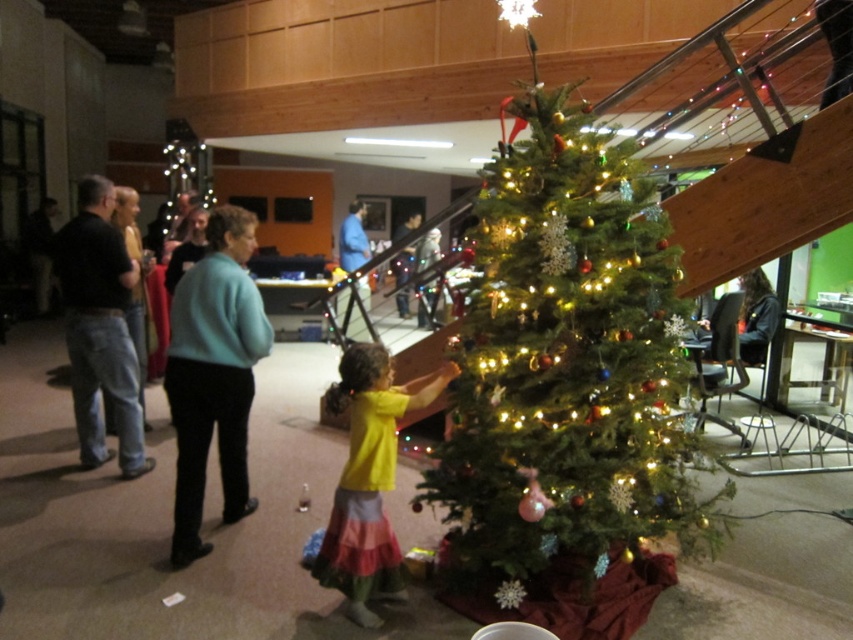
The width and height of the screenshot is (853, 640). Describe the element at coordinates (213, 374) in the screenshot. I see `teal sweater at center` at that location.

Is point (219, 268) positioned before point (68, 276)?

Yes, it is.

The height and width of the screenshot is (640, 853). Identify the location of teal sweater at center. (213, 374).

Locate an element on the screen. teal sweater at center is located at coordinates (213, 374).

Measure the distance between green matte christmas tree at center and teal sweater at center.

green matte christmas tree at center and teal sweater at center are 1.16 meters apart from each other.

Measure the distance from green matte christmas tree at center to teal sweater at center.

1.16 meters

What do you see at coordinates (566, 365) in the screenshot? I see `green matte christmas tree at center` at bounding box center [566, 365].

Identify the location of green matte christmas tree at center. (566, 365).

Which of these two, teal sweater at center or light blue sweater at left, stands shorter?

teal sweater at center

The image size is (853, 640). What do you see at coordinates (213, 374) in the screenshot?
I see `teal sweater at center` at bounding box center [213, 374].

Is point (201, 289) positioned in front of point (128, 308)?

Yes, point (201, 289) is closer to viewer.

You are a GUI agent. You are given a task and a screenshot of the screen. Output one action in this format:
    pyautogui.click(x=<x>, y=<y>)
    Task: Click on the teal sweater at center
    
    Given the screenshot: What is the action you would take?
    213,374